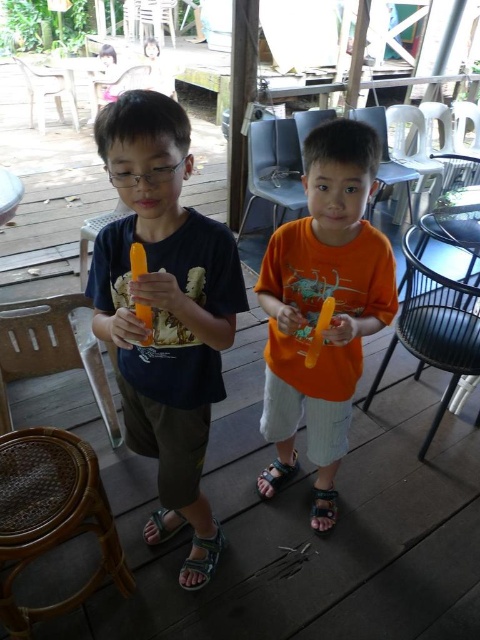
Question: Which point appears farthest from the camera in this image?

Choices:
 (A) (165, 524)
 (B) (218, 547)
 (C) (351, 381)

Answer: (A)

Question: Does brown leather sandal at lower center lie behind dark blue leather sandal at lower center?

Choices:
 (A) yes
 (B) no

Answer: (B)

Question: Is black leather sandal at lower center closer to camera compared to dark blue leather sandal at lower center?

Choices:
 (A) no
 (B) yes

Answer: (B)

Question: Which point appears farthest from the camera in this image?

Choices:
 (A) (183, 582)
 (B) (165, 525)
 (C) (312, 243)

Answer: (B)

Question: Which object is positioned closest to the brown leather sandal at lower center?

Choices:
 (A) green fabric sandal at lower center
 (B) dark blue leather sandal at lower center
 (C) black leather sandal at lower center
 (D) orange matte shirt at center

Answer: (B)

Question: Can you confirm if green fabric sandal at lower center is positioned to the right of dark blue leather sandal at lower center?

Choices:
 (A) no
 (B) yes

Answer: (A)